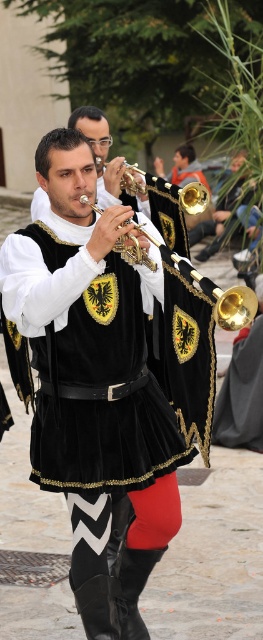
In the image, there is a gold shiny trumpet at center and a point marked at coordinates (134,252). Is the gold shiny trumpet at center located exactly at that point?

Yes, the gold shiny trumpet at center is located at point (134,252).

Consider the image. You are a musician who wants to choose the taller trumpet between the velvet black trumpet at center and the gold shiny trumpet at upper center. Which trumpet should you pick?

You should pick the velvet black trumpet at center because it is taller than the gold shiny trumpet at upper center.

You are a stagehand setting up for a performance. You have two gold shiny trumpets to place on a narrow stage. The first is the gold shiny trumpet at center, and the second is the gold shiny trumpet at upper center. Which trumpet should you choose to fit better on the narrow stage?

The gold shiny trumpet at upper center should be chosen because it has a smaller width compared to the gold shiny trumpet at center, making it more suitable for the narrow stage.